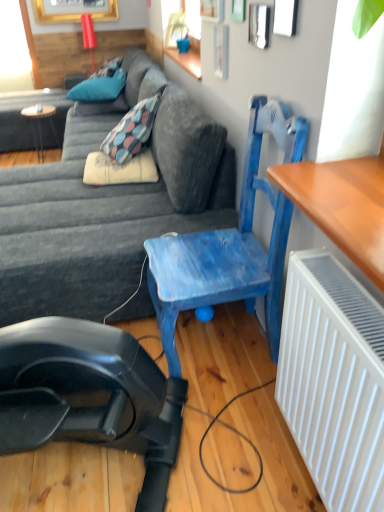
Describe the element at coordinates (108, 207) in the screenshot. I see `dark gray fabric couch at center` at that location.

Where is `dark gray fabric couch at center`? dark gray fabric couch at center is located at coordinates (108, 207).

Image resolution: width=384 pixels, height=512 pixels. Describe the element at coordinates (223, 260) in the screenshot. I see `blue painted wood chair at center` at that location.

The height and width of the screenshot is (512, 384). What do you see at coordinates (99, 88) in the screenshot?
I see `blue fabric pillow at upper left, which ranks as the second pillow in front-to-back order` at bounding box center [99, 88].

Describe the element at coordinates (119, 169) in the screenshot. I see `beige fabric pillow at center, the 3th pillow in the back-to-front sequence` at that location.

Locate an element on the screen. The image size is (384, 512). dark gray fabric couch at center is located at coordinates (108, 207).

Considering the relative sizes of wooden round table at left and blue fabric pillow at upper left, which is the third pillow from bottom to top, in the image provided, is wooden round table at left taller than blue fabric pillow at upper left, which is the third pillow from bottom to top,?

Yes, wooden round table at left is taller than blue fabric pillow at upper left, which is the third pillow from bottom to top.

From a real-world perspective, between wooden round table at left and blue fabric pillow at upper left, which ranks as the second pillow in front-to-back order, who is vertically lower?

In real-world perspective, wooden round table at left is lower.

The image size is (384, 512). Find the location of `table located below the blue fabric pillow at upper left, which ranks as the second pillow in front-to-back order (from the image's perspective)`. table located below the blue fabric pillow at upper left, which ranks as the second pillow in front-to-back order (from the image's perspective) is located at coordinates (40, 124).

Who is taller, wooden round table at left or dark gray fabric couch at center?

dark gray fabric couch at center is taller.

Which is in front, point (51, 119) or point (111, 306)?

Positioned in front is point (111, 306).

Considering their positions, is wooden round table at left located in front of or behind dark gray fabric couch at center?

wooden round table at left is behind dark gray fabric couch at center.

Could you tell me if wooden round table at left is turned towards dark gray fabric couch at center?

Yes.

From the image's perspective, is blue fabric pillow at upper left, acting as the 1th pillow starting from the top, on top of blue painted wood chair at center?

Yes, from the image's perspective, blue fabric pillow at upper left, acting as the 1th pillow starting from the top, is above blue painted wood chair at center.

Is blue fabric pillow at upper left, acting as the 1th pillow starting from the top, not near blue painted wood chair at center?

Yes, blue fabric pillow at upper left, acting as the 1th pillow starting from the top, and blue painted wood chair at center are quite far apart.

Does blue fabric pillow at upper left, which ranks as the second pillow in front-to-back order, appear on the right side of blue painted wood chair at center?

In fact, blue fabric pillow at upper left, which ranks as the second pillow in front-to-back order, is to the left of blue painted wood chair at center.

Between blue fabric pillow at upper left, placed as the 2th pillow when sorted from back to front, and blue painted wood chair at center, which one is positioned in front?

blue painted wood chair at center is closer to the camera.

What's the angular difference between blue fabric pillow at upper left, acting as the 1th pillow starting from the top, and teal fabric pillow at upper left, arranged as the first pillow when viewed from the back,'s facing directions?

They differ by 8.48 degrees in their facing directions.

Could you tell me if blue fabric pillow at upper left, placed as the 2th pillow when sorted from back to front, is turned towards teal fabric pillow at upper left, arranged as the first pillow when viewed from the back?

No, blue fabric pillow at upper left, placed as the 2th pillow when sorted from back to front, is not aimed at teal fabric pillow at upper left, arranged as the first pillow when viewed from the back.

Is blue fabric pillow at upper left, acting as the 1th pillow starting from the top, not near teal fabric pillow at upper left, arranged as the first pillow when viewed from the back?

No, blue fabric pillow at upper left, acting as the 1th pillow starting from the top, is not far away from teal fabric pillow at upper left, arranged as the first pillow when viewed from the back.

From a real-world perspective, between beige fabric pillow at center, the 3th pillow in the back-to-front sequence, and dark gray fabric couch at center, who is vertically lower?

dark gray fabric couch at center is physically lower.

Considering the relative positions of beige fabric pillow at center, marked as the first pillow in a bottom-to-top arrangement, and dark gray fabric couch at center in the image provided, is beige fabric pillow at center, marked as the first pillow in a bottom-to-top arrangement, in front of dark gray fabric couch at center?

No, beige fabric pillow at center, marked as the first pillow in a bottom-to-top arrangement, is further to the viewer.

Is beige fabric pillow at center, which ranks as the third pillow in top-to-bottom order, turned away from dark gray fabric couch at center?

That's right, beige fabric pillow at center, which ranks as the third pillow in top-to-bottom order, is facing away from dark gray fabric couch at center.

Could you tell me if teal fabric pillow at upper left, the 2th pillow from the bottom, is turned towards beige fabric pillow at center, which ranks as the third pillow in top-to-bottom order?

Yes, teal fabric pillow at upper left, the 2th pillow from the bottom, is facing beige fabric pillow at center, which ranks as the third pillow in top-to-bottom order.

Is teal fabric pillow at upper left, arranged as the first pillow when viewed from the back, next to beige fabric pillow at center, marked as the first pillow in a bottom-to-top arrangement, and touching it?

No, teal fabric pillow at upper left, arranged as the first pillow when viewed from the back, is not in contact with beige fabric pillow at center, marked as the first pillow in a bottom-to-top arrangement.

How different are the orientations of teal fabric pillow at upper left, arranged as the first pillow when viewed from the back, and beige fabric pillow at center, the 3th pillow in the back-to-front sequence, in degrees?

The angle between the facing direction of teal fabric pillow at upper left, arranged as the first pillow when viewed from the back, and the facing direction of beige fabric pillow at center, the 3th pillow in the back-to-front sequence, is 87.8 degrees.

Which object is wider, teal fabric pillow at upper left, which appears as the third pillow when viewed from the front, or beige fabric pillow at center, which ranks as the third pillow in top-to-bottom order?

teal fabric pillow at upper left, which appears as the third pillow when viewed from the front.

Looking at this image, is teal fabric pillow at upper left, acting as the 2th pillow starting from the top, outside of blue painted wood chair at center?

Yes, teal fabric pillow at upper left, acting as the 2th pillow starting from the top, is not within blue painted wood chair at center.

Consider the image. Could you tell me if teal fabric pillow at upper left, which appears as the third pillow when viewed from the front, is turned towards blue painted wood chair at center?

Yes, teal fabric pillow at upper left, which appears as the third pillow when viewed from the front, is oriented towards blue painted wood chair at center.

Between teal fabric pillow at upper left, the 2th pillow from the bottom, and blue painted wood chair at center, which one appears on the left side from the viewer's perspective?

From the viewer's perspective, teal fabric pillow at upper left, the 2th pillow from the bottom, appears more on the left side.

From the image's perspective, is teal fabric pillow at upper left, acting as the 2th pillow starting from the top, above blue painted wood chair at center?

Yes, from the image's perspective, teal fabric pillow at upper left, acting as the 2th pillow starting from the top, is on top of blue painted wood chair at center.

You are a GUI agent. You are given a task and a screenshot of the screen. Output one action in this format:
    pyautogui.click(x=<x>, y=<y>)
    Task: Click on the table that is below the blue fabric pillow at upper left, placed as the 2th pillow when sorted from back to front (from the image's perspective)
    
    Given the screenshot: What is the action you would take?
    pyautogui.click(x=40, y=124)

Identify the location of table to the left of dark gray fabric couch at center. (40, 124).

When comparing their distances from wooden round table at left, does teal fabric pillow at upper left, which appears as the third pillow when viewed from the front, or dark gray fabric couch at center seem closer?

Among the two, teal fabric pillow at upper left, which appears as the third pillow when viewed from the front, is located nearer to wooden round table at left.

When comparing their distances from blue painted wood chair at center, does teal fabric pillow at upper left, the 2th pillow from the bottom, or blue fabric pillow at upper left, which is the third pillow from bottom to top, seem closer?

Among the two, teal fabric pillow at upper left, the 2th pillow from the bottom, is located nearer to blue painted wood chair at center.

Looking at the image, which one is located closer to blue fabric pillow at upper left, which ranks as the second pillow in front-to-back order, wooden round table at left or beige fabric pillow at center, the 3th pillow in the back-to-front sequence?

wooden round table at left is positioned closer to the anchor blue fabric pillow at upper left, which ranks as the second pillow in front-to-back order.

Based on their spatial positions, is dark gray fabric couch at center or teal fabric pillow at upper left, arranged as the first pillow when viewed from the back, further from wooden round table at left?

dark gray fabric couch at center is positioned further to the anchor wooden round table at left.

Based on their spatial positions, is beige fabric pillow at center, marked as the first pillow in a bottom-to-top arrangement, or dark gray fabric couch at center further from blue fabric pillow at upper left, which is the third pillow from bottom to top?

dark gray fabric couch at center lies further to blue fabric pillow at upper left, which is the third pillow from bottom to top, than the other object.

Looking at this image, based on their spatial positions, is blue fabric pillow at upper left, acting as the 1th pillow starting from the top, or dark gray fabric couch at center further from teal fabric pillow at upper left, the 2th pillow from the bottom?

Among the two, dark gray fabric couch at center is located further to teal fabric pillow at upper left, the 2th pillow from the bottom.

Consider the image. Looking at the image, which one is located closer to teal fabric pillow at upper left, which appears as the third pillow when viewed from the front, blue painted wood chair at center or beige fabric pillow at center, which ranks as the third pillow in top-to-bottom order?

beige fabric pillow at center, which ranks as the third pillow in top-to-bottom order, is closer to teal fabric pillow at upper left, which appears as the third pillow when viewed from the front.

Estimate the real-world distances between objects in this image. Which object is further from blue fabric pillow at upper left, placed as the 2th pillow when sorted from back to front, teal fabric pillow at upper left, the 2th pillow from the bottom, or beige fabric pillow at center, the 3th pillow in the back-to-front sequence?

Based on the image, beige fabric pillow at center, the 3th pillow in the back-to-front sequence, appears to be further to blue fabric pillow at upper left, placed as the 2th pillow when sorted from back to front.

Find the location of a particular element. studio couch between blue painted wood chair at center and teal fabric pillow at upper left, the 2th pillow from the bottom, along the z-axis is located at coordinates (108, 207).

I want to click on studio couch located between blue painted wood chair at center and blue fabric pillow at upper left, which is the third pillow from bottom to top, in the depth direction, so click(108, 207).

What are the coordinates of `pillow between beige fabric pillow at center, marked as the first pillow in a bottom-to-top arrangement, and teal fabric pillow at upper left, which appears as the third pillow when viewed from the front, from front to back` in the screenshot? It's located at (99, 88).

This screenshot has height=512, width=384. Identify the location of pillow between beige fabric pillow at center, arranged as the 1th pillow when viewed from the front, and wooden round table at left, along the z-axis. (99, 88).